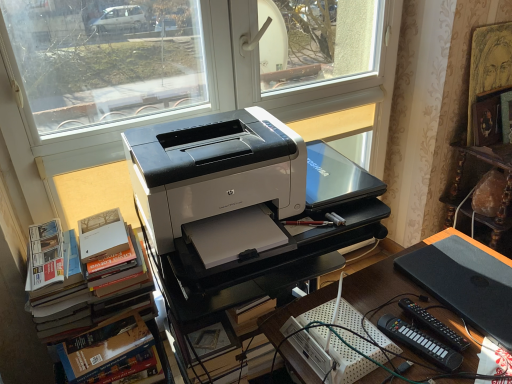
Question: Is hardcover books at left shorter than white glossy printer at center?

Choices:
 (A) yes
 (B) no

Answer: (A)

Question: Is hardcover books at left not within white glossy printer at center?

Choices:
 (A) no
 (B) yes

Answer: (B)

Question: Can you confirm if hardcover books at left is thinner than white glossy printer at center?

Choices:
 (A) yes
 (B) no

Answer: (A)

Question: Does hardcover books at left have a greater width compared to white glossy printer at center?

Choices:
 (A) no
 (B) yes

Answer: (A)

Question: From the image's perspective, is hardcover books at left located beneath white glossy printer at center?

Choices:
 (A) yes
 (B) no

Answer: (B)

Question: Is hardcover books at left smaller than white glossy printer at center?

Choices:
 (A) no
 (B) yes

Answer: (B)

Question: Would you say hardcover books at left is part of black plastic remote control at lower right, positioned as the second equipment in right-to-left order,'s contents?

Choices:
 (A) yes
 (B) no

Answer: (B)

Question: Is black plastic remote control at lower right, acting as the 1th equipment starting from the left, looking in the opposite direction of hardcover books at left?

Choices:
 (A) no
 (B) yes

Answer: (A)

Question: Is black plastic remote control at lower right, positioned as the second equipment in right-to-left order, not inside hardcover books at left?

Choices:
 (A) yes
 (B) no

Answer: (A)

Question: Does black plastic remote control at lower right, positioned as the second equipment in right-to-left order, have a greater height compared to hardcover books at left?

Choices:
 (A) yes
 (B) no

Answer: (B)

Question: Is black plastic remote control at lower right, positioned as the second equipment in right-to-left order, not close to hardcover books at left?

Choices:
 (A) yes
 (B) no

Answer: (B)

Question: Does black plastic remote control at lower right, acting as the 1th equipment starting from the left, appear on the left side of hardcover books at left?

Choices:
 (A) no
 (B) yes

Answer: (A)

Question: Does white glossy printer at center have a greater height compared to black matte laptop at lower right?

Choices:
 (A) no
 (B) yes

Answer: (B)